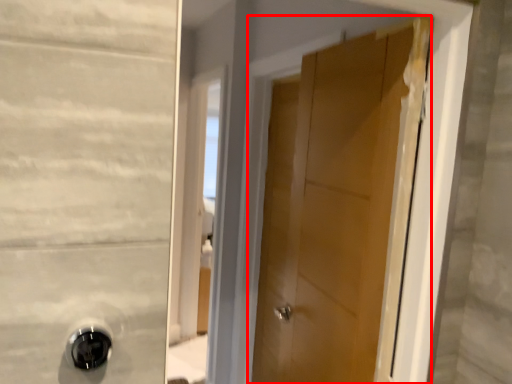
Question: From the image, what is the correct spatial relationship of door (annotated by the red box) in relation to door handle?

Choices:
 (A) right
 (B) left

Answer: (A)